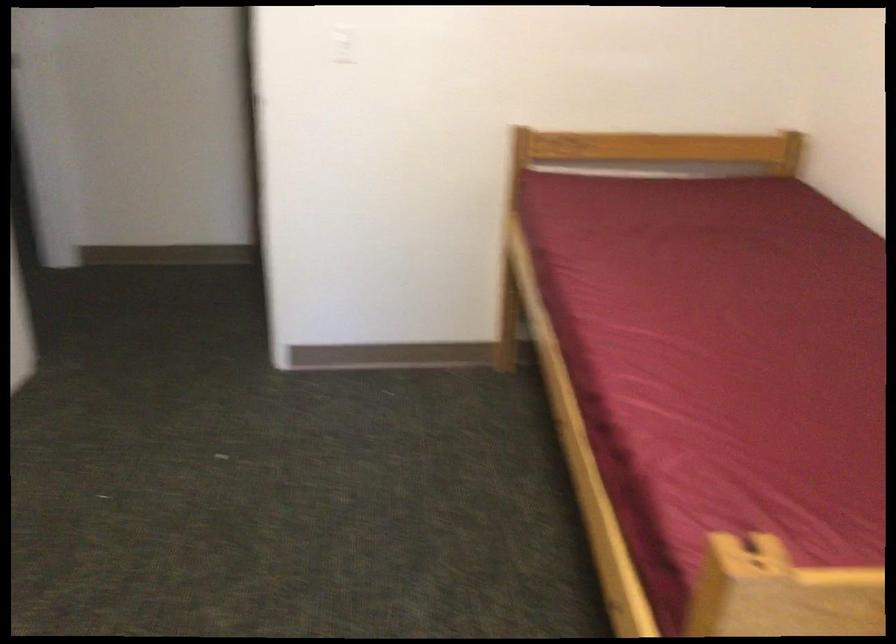
You are a GUI agent. You are given a task and a screenshot of the screen. Output one action in this format:
    pyautogui.click(x=<x>, y=<y>)
    Task: Click on the red bed sheet
    The height and width of the screenshot is (644, 896).
    Given the screenshot: What is the action you would take?
    pyautogui.click(x=719, y=348)